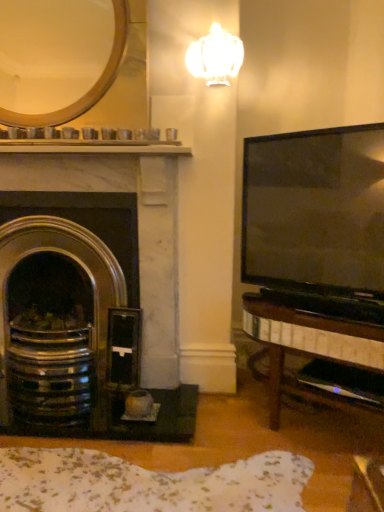
Question: From the image's perspective, is gold metallic mirror at upper left beneath polished brass fireplace at left?

Choices:
 (A) yes
 (B) no

Answer: (B)

Question: Is gold metallic mirror at upper left in front of polished brass fireplace at left?

Choices:
 (A) no
 (B) yes

Answer: (B)

Question: From a real-world perspective, is gold metallic mirror at upper left located beneath polished brass fireplace at left?

Choices:
 (A) yes
 (B) no

Answer: (B)

Question: Does gold metallic mirror at upper left have a greater height compared to polished brass fireplace at left?

Choices:
 (A) no
 (B) yes

Answer: (A)

Question: Is gold metallic mirror at upper left far from polished brass fireplace at left?

Choices:
 (A) yes
 (B) no

Answer: (B)

Question: Is gold metallic mirror at upper left bigger or smaller than white glossy lamp at upper center?

Choices:
 (A) small
 (B) big

Answer: (B)

Question: Looking at their shapes, would you say gold metallic mirror at upper left is wider or thinner than white glossy lamp at upper center?

Choices:
 (A) wide
 (B) thin

Answer: (A)

Question: Considering the positions of point (29, 66) and point (221, 50), is point (29, 66) closer or farther from the camera than point (221, 50)?

Choices:
 (A) farther
 (B) closer

Answer: (A)

Question: From the image's perspective, is gold metallic mirror at upper left positioned above or below white glossy lamp at upper center?

Choices:
 (A) below
 (B) above

Answer: (A)

Question: In the image, is polished brass fireplace at left positioned in front of or behind white glossy lamp at upper center?

Choices:
 (A) behind
 (B) front

Answer: (A)

Question: In terms of height, does polished brass fireplace at left look taller or shorter compared to white glossy lamp at upper center?

Choices:
 (A) tall
 (B) short

Answer: (A)

Question: In the image, is polished brass fireplace at left on the left side or the right side of white glossy lamp at upper center?

Choices:
 (A) left
 (B) right

Answer: (A)

Question: From the image's perspective, is polished brass fireplace at left positioned above or below white glossy lamp at upper center?

Choices:
 (A) below
 (B) above

Answer: (A)

Question: From a real-world perspective, is gold metallic mirror at upper left physically located above or below polished brass fireplace at left?

Choices:
 (A) below
 (B) above

Answer: (B)

Question: Is gold metallic mirror at upper left taller or shorter than polished brass fireplace at left?

Choices:
 (A) short
 (B) tall

Answer: (A)